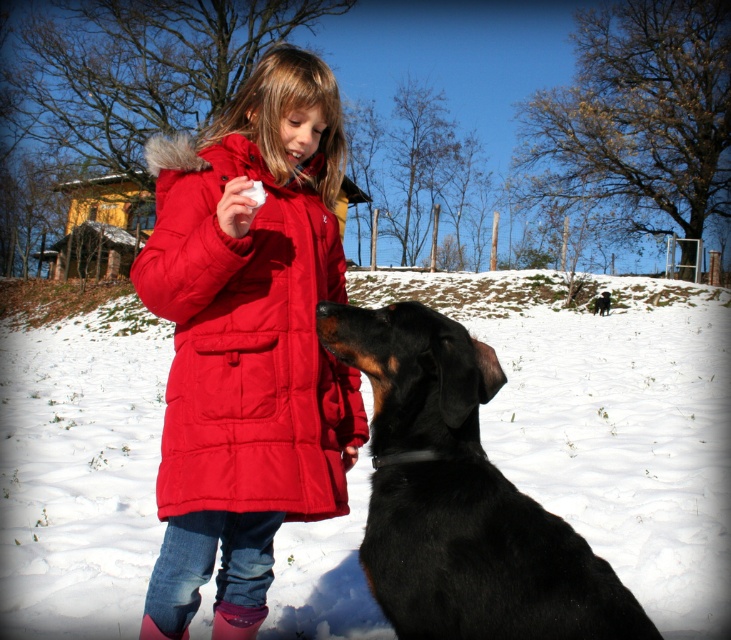
Question: Is matte red coat at center to the right of black smooth fur dog at lower right from the viewer's perspective?

Choices:
 (A) yes
 (B) no

Answer: (B)

Question: Which point is closer to the camera taking this photo?

Choices:
 (A) (181, 307)
 (B) (45, 332)

Answer: (A)

Question: Which of the following is the closest to the observer?

Choices:
 (A) (599, 576)
 (B) (102, 516)
 (C) (183, 368)

Answer: (A)

Question: Does white fluffy snow at center appear on the right side of black smooth fur dog at lower right?

Choices:
 (A) no
 (B) yes

Answer: (B)

Question: Where is white fluffy snow at center located in relation to matte red coat at center in the image?

Choices:
 (A) below
 (B) above

Answer: (B)

Question: Which object is farther from the camera taking this photo?

Choices:
 (A) white fluffy snow at center
 (B) matte red coat at center

Answer: (A)